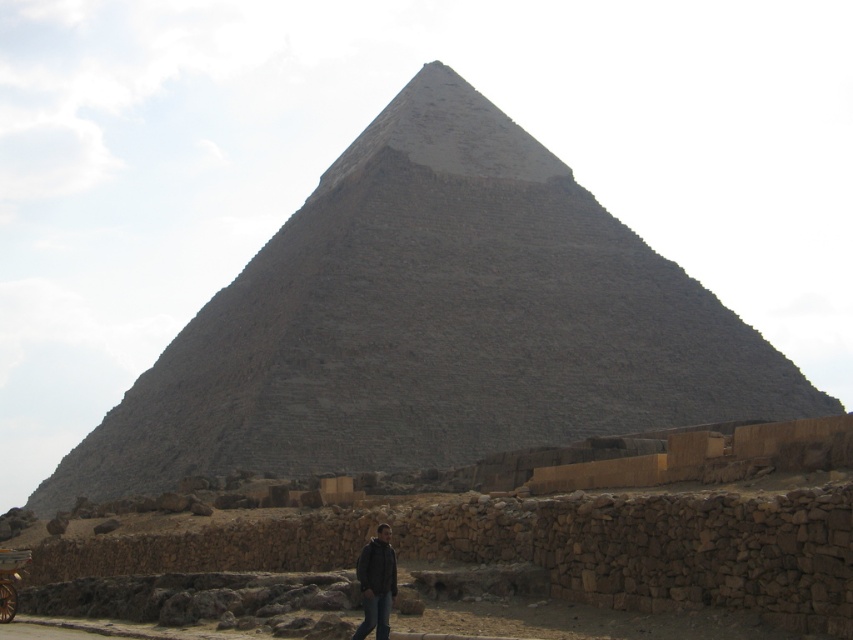
Question: Can you confirm if gray stone pyramid at center is wider than black leather jacket at lower center?

Choices:
 (A) no
 (B) yes

Answer: (B)

Question: Which point appears farthest from the camera in this image?

Choices:
 (A) (445, 360)
 (B) (366, 561)

Answer: (A)

Question: Does gray stone pyramid at center come in front of black leather jacket at lower center?

Choices:
 (A) no
 (B) yes

Answer: (A)

Question: Which point is farther to the camera?

Choices:
 (A) black leather jacket at lower center
 (B) gray stone pyramid at center

Answer: (B)

Question: From the image, what is the correct spatial relationship of gray stone pyramid at center in relation to black leather jacket at lower center?

Choices:
 (A) above
 (B) below

Answer: (A)

Question: Which point is farther from the camera taking this photo?

Choices:
 (A) (370, 460)
 (B) (369, 566)

Answer: (A)